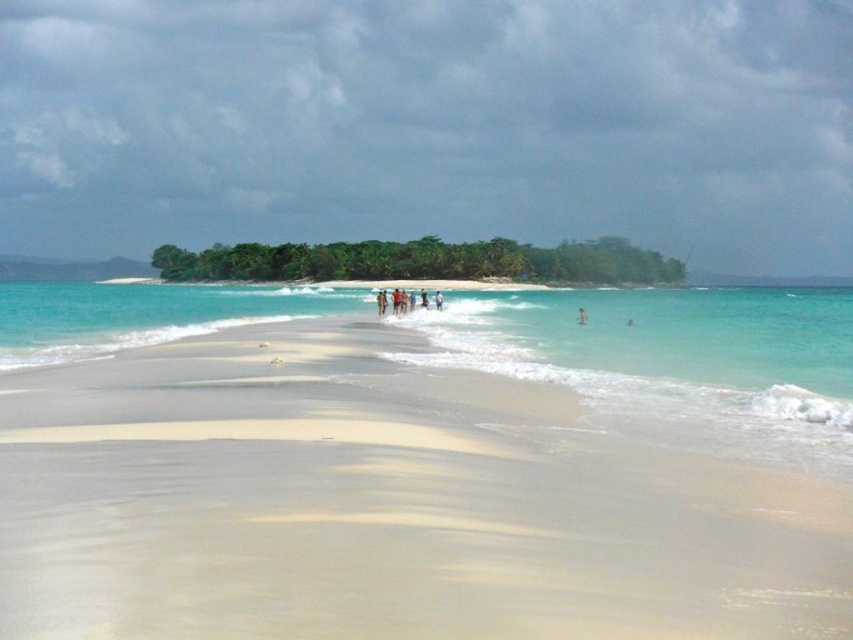
You are a drone operator trying to capture a photo of the white sand beach at center. The drone must hover exactly at the coordinates provided in the scene description. What are the coordinates where the drone should position itself?

The white sand beach at center is located at point (x=422, y=467), so the drone should position itself at those coordinates to capture the photo.